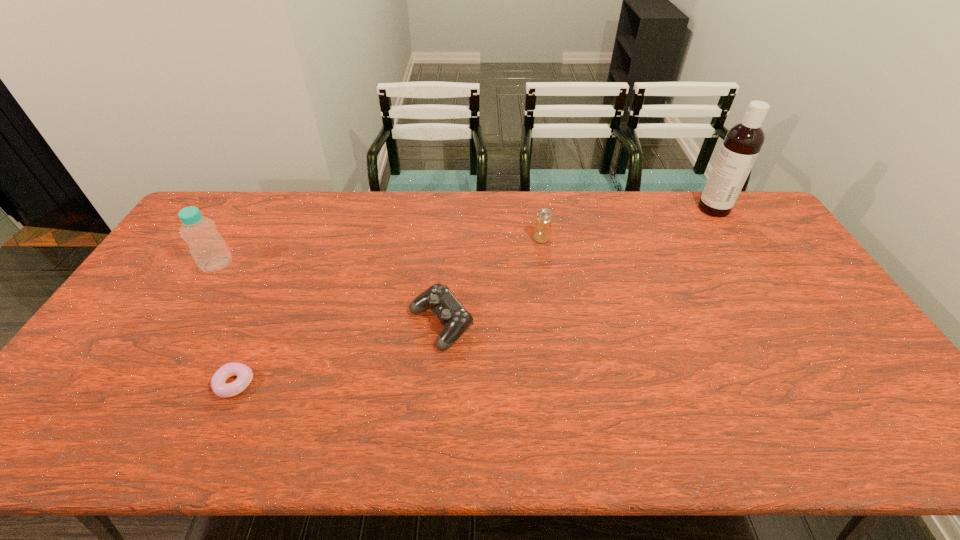
Locate an element on the screen. This screenshot has width=960, height=540. object that is at the far right corner is located at coordinates (743, 142).

In the image, there is a desktop. Identify the location of vacant space at the far edge. The height and width of the screenshot is (540, 960). (454, 193).

The height and width of the screenshot is (540, 960). In the image, there is a desktop. What are the coordinates of `free space at the near edge` in the screenshot? It's located at (119, 443).

You are a GUI agent. You are given a task and a screenshot of the screen. Output one action in this format:
    pyautogui.click(x=<x>, y=<y>)
    Task: Click on the free location at the left edge of the desktop
    This screenshot has width=960, height=540.
    Given the screenshot: What is the action you would take?
    pyautogui.click(x=77, y=399)

This screenshot has width=960, height=540. Identify the location of free space at the right edge of the desktop. (767, 292).

Locate an element on the screen. This screenshot has width=960, height=540. vacant space at the far left corner of the desktop is located at coordinates (226, 214).

Where is `vacant space in between the second object from left to right and the fourth nearest object`? vacant space in between the second object from left to right and the fourth nearest object is located at coordinates pyautogui.click(x=388, y=312).

The width and height of the screenshot is (960, 540). Find the location of `free space between the doughnut and the fourth farthest object`. free space between the doughnut and the fourth farthest object is located at coordinates (338, 354).

At what (x,y) coordinates should I click in order to perform the action: click on vacant space in between the rightmost object and the third tallest object. Please return your answer as a coordinate pair (x, y). This screenshot has width=960, height=540. Looking at the image, I should click on (628, 224).

This screenshot has width=960, height=540. I want to click on free space between the third shortest object and the control, so click(x=492, y=282).